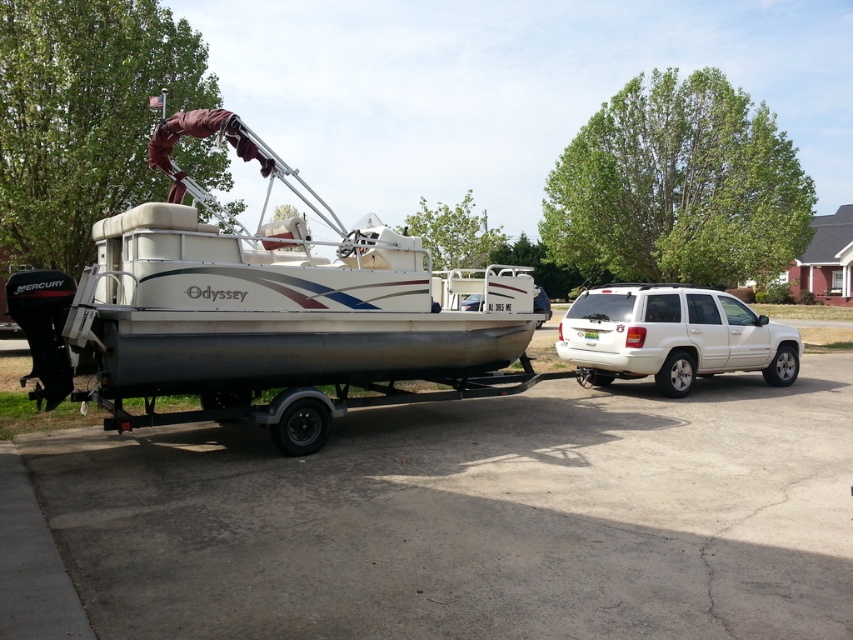
Does white matte suv at right have a lesser height compared to white matte boat at center?

No, white matte suv at right is not shorter than white matte boat at center.

Can you confirm if white matte suv at right is positioned to the right of white matte boat at center?

Yes, white matte suv at right is to the right of white matte boat at center.

What do you see at coordinates (672, 337) in the screenshot? I see `white matte suv at right` at bounding box center [672, 337].

I want to click on white matte suv at right, so click(672, 337).

Who is shorter, silver metallic pontoon boat at left or white matte suv at right?

silver metallic pontoon boat at left

Is silver metallic pontoon boat at left below white matte suv at right?

Incorrect, silver metallic pontoon boat at left is not positioned below white matte suv at right.

Does point (144, 289) lie in front of point (672, 352)?

Yes, point (144, 289) is in front of point (672, 352).

The image size is (853, 640). Find the location of `silver metallic pontoon boat at left`. silver metallic pontoon boat at left is located at coordinates (263, 312).

Is point (44, 282) behind point (535, 305)?

No, it is not.

From the picture: Can you confirm if silver metallic pontoon boat at left is bigger than white matte boat at center?

Actually, silver metallic pontoon boat at left might be smaller than white matte boat at center.

Image resolution: width=853 pixels, height=640 pixels. In order to click on silver metallic pontoon boat at left in this screenshot , I will do `click(263, 312)`.